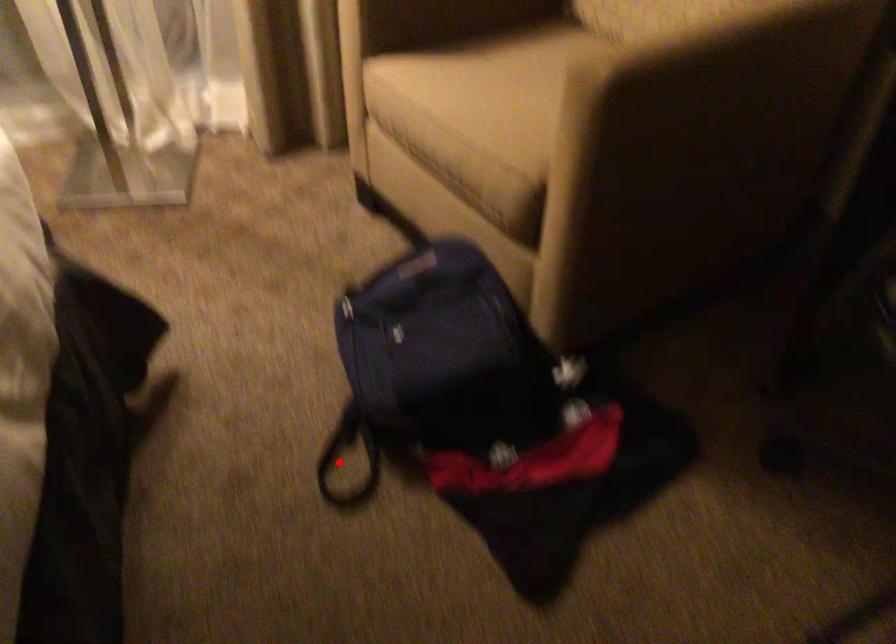
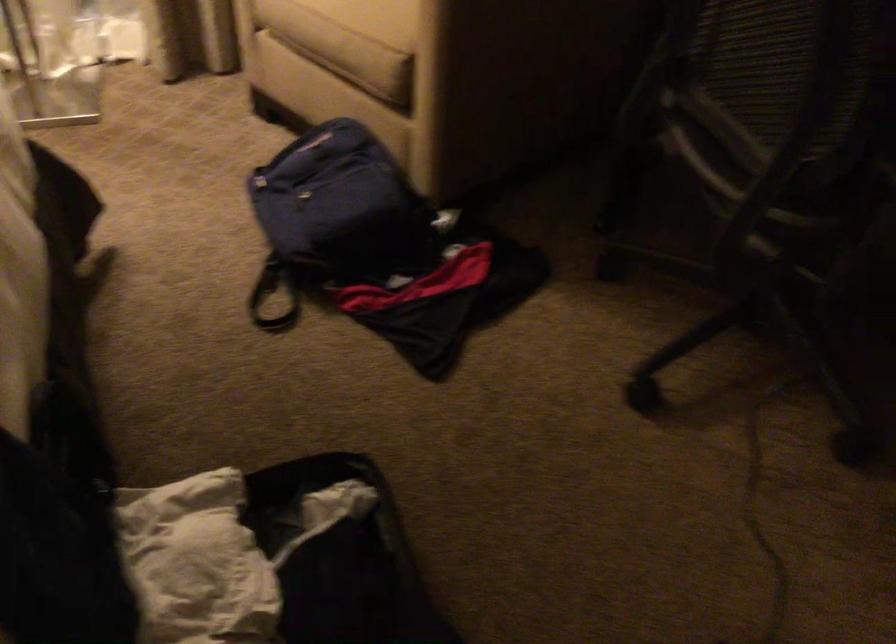
The point at the highlighted location is marked in the first image. Where is the corresponding point in the second image?

(263, 297)